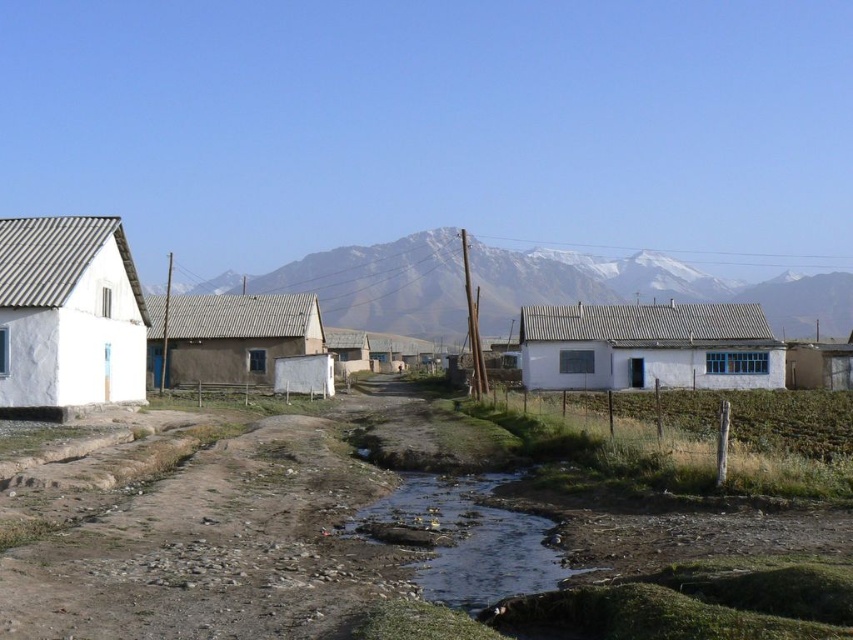
Is white matte house at center to the left of brown muddy stream at center from the viewer's perspective?

In fact, white matte house at center is to the right of brown muddy stream at center.

Can you confirm if white matte house at center is wider than brown muddy stream at center?

Yes, white matte house at center is wider than brown muddy stream at center.

Between point (595, 317) and point (523, 531), which one is positioned behind?

Point (595, 317)

Where is `white matte house at center`? The height and width of the screenshot is (640, 853). white matte house at center is located at coordinates (648, 346).

Does point (523, 522) lie in front of point (292, 518)?

That is False.

Can you confirm if brown soil at center is thinner than brown gravel dirt track at lower center?

No, brown soil at center is not thinner than brown gravel dirt track at lower center.

Between point (668, 618) and point (216, 465), which one is positioned in front?

Point (668, 618) is more forward.

The height and width of the screenshot is (640, 853). I want to click on brown soil at center, so click(339, 529).

Can you confirm if white matte house at center is positioned above brown mudbrick house at center?

Correct, white matte house at center is located above brown mudbrick house at center.

Is white matte house at center positioned behind brown mudbrick house at center?

That is True.

Which is in front, point (746, 324) or point (202, 353)?

Point (746, 324) is more forward.

The width and height of the screenshot is (853, 640). In order to click on white matte house at center in this screenshot , I will do click(648, 346).